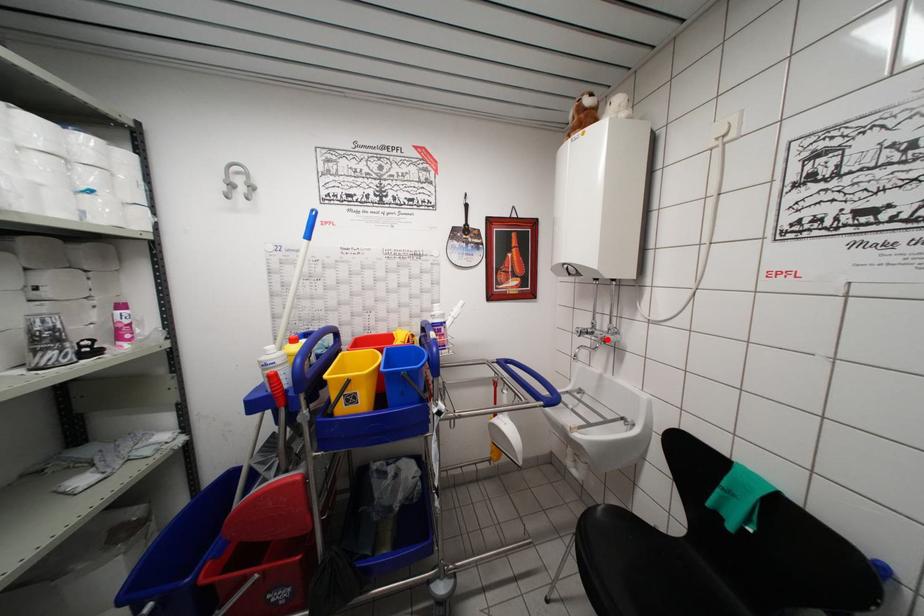
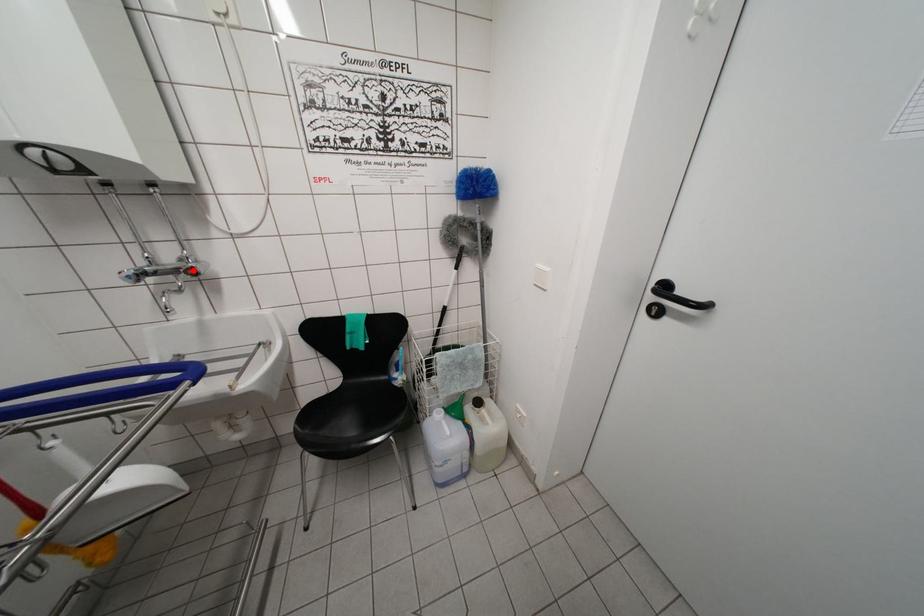
I am providing you with two images of the same scene from different viewpoints. A red point is marked on the first image and another point is marked on the second image. Is the red point in image1 aligned with the point shown in image2?

Yes